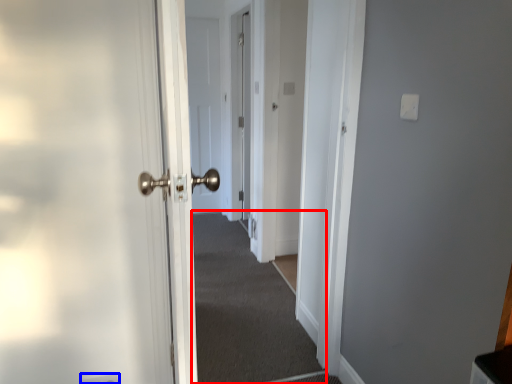
Question: Among these objects, which one is farthest to the camera, corridor (highlighted by a red box) or electric outlet (highlighted by a blue box)?

Choices:
 (A) corridor
 (B) electric outlet

Answer: (A)